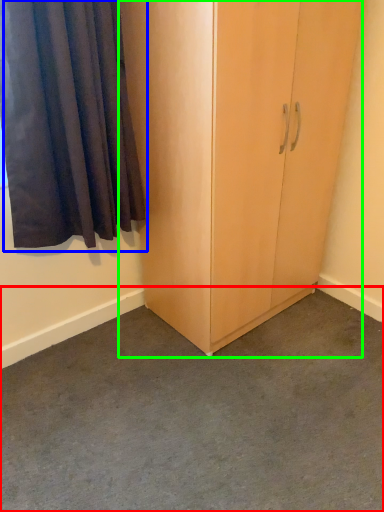
Question: Considering the real-world distances, which object is closest to concrete (highlighted by a red box)? curtain (highlighted by a blue box) or cupboard (highlighted by a green box).

Choices:
 (A) curtain
 (B) cupboard

Answer: (B)